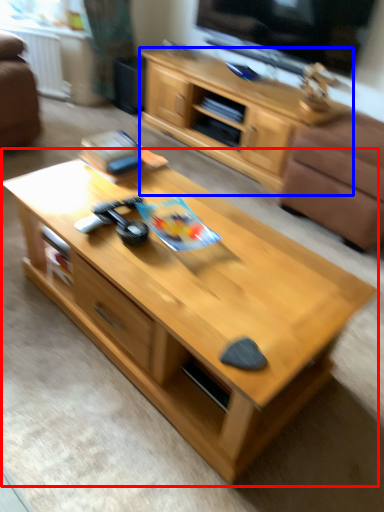
Question: Which object is further to the camera taking this photo, coffee table (highlighted by a red box) or cabinetry (highlighted by a blue box)?

Choices:
 (A) coffee table
 (B) cabinetry

Answer: (B)